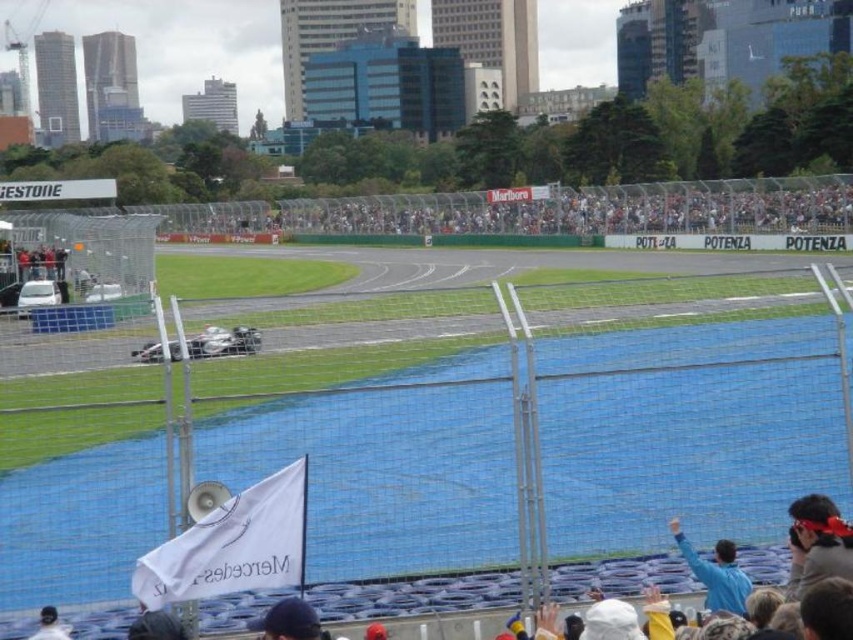
Between blue fabric at lower right and white matte race car at center, which one is positioned higher?

white matte race car at center is higher up.

Is blue fabric at lower right shorter than white matte race car at center?

No.

The width and height of the screenshot is (853, 640). I want to click on blue fabric at lower right, so click(717, 573).

Is gray fabric cap at lower right to the right of blue fabric at lower right from the viewer's perspective?

Indeed, gray fabric cap at lower right is positioned on the right side of blue fabric at lower right.

How distant is gray fabric cap at lower right from blue fabric at lower right?

gray fabric cap at lower right is 26.52 inches away from blue fabric at lower right.

Who is more distant from viewer, (816, 556) or (709, 573)?

Positioned behind is point (709, 573).

Image resolution: width=853 pixels, height=640 pixels. I want to click on gray fabric cap at lower right, so click(x=819, y=541).

Is point (767, 204) more distant than point (248, 346)?

Yes.

Which is behind, point (628, 189) or point (172, 353)?

Point (628, 189)

At what (x,y) coordinates should I click in order to perform the action: click on white mesh crowd at center. Please return your answer as a coordinate pair (x, y). Image resolution: width=853 pixels, height=640 pixels. Looking at the image, I should click on (550, 211).